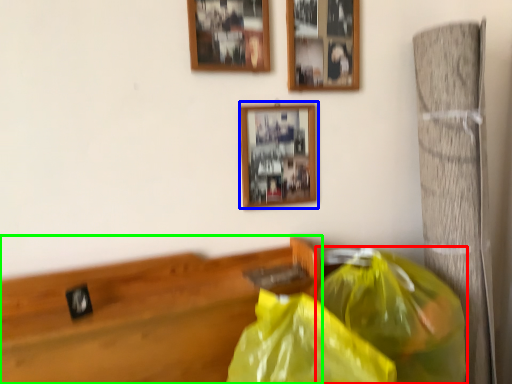
Question: Which object is positioned closest to plastic bag (highlighted by a red box)? Select from picture frame (highlighted by a blue box) and furniture (highlighted by a green box).

Choices:
 (A) picture frame
 (B) furniture

Answer: (B)